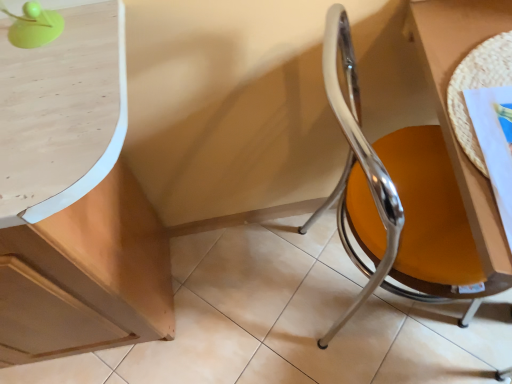
This screenshot has height=384, width=512. Identify the location of vacant region to the right of light brown wood cabinet at left. (257, 302).